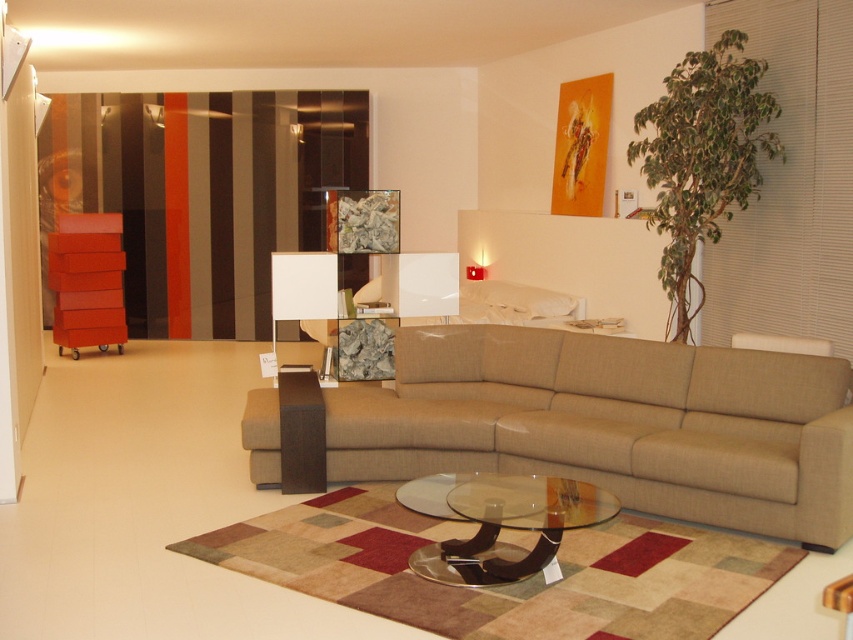
Does beige fabric couch at center have a lesser height compared to transparent glass coffee table at center?

Incorrect, beige fabric couch at center's height does not fall short of transparent glass coffee table at center's.

Which is in front, point (618, 444) or point (438, 557)?

Point (438, 557) is more forward.

This screenshot has height=640, width=853. Identify the location of beige fabric couch at center. (613, 422).